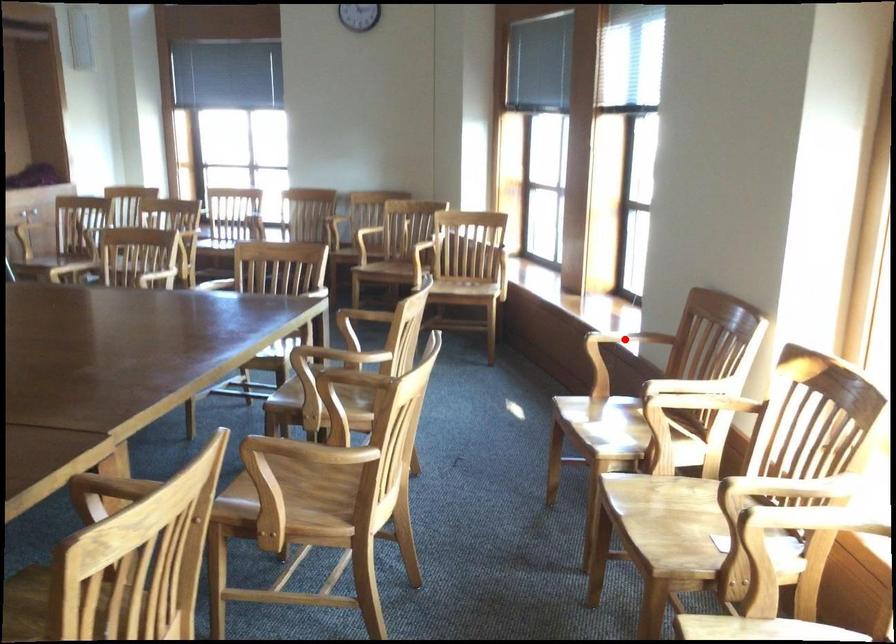
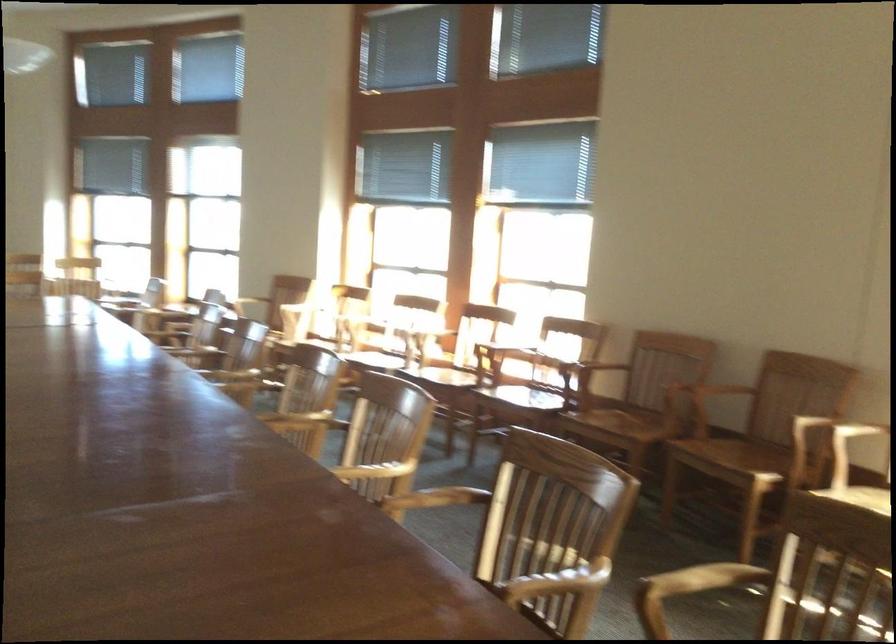
Question: I am providing you with two images of the same scene from different viewpoints. A red point is marked on the first image. At the location where the point appears in image 1, is it still visible in image 2?

Choices:
 (A) Yes
 (B) No

Answer: (B)